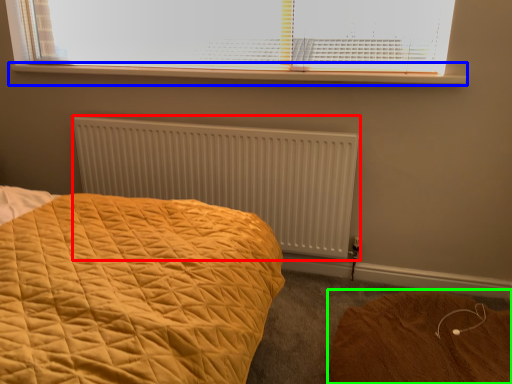
Question: Which object is the farthest from radiator (highlighted by a red box)? Choose among these: window sill (highlighted by a blue box) or plain (highlighted by a green box).

Choices:
 (A) window sill
 (B) plain

Answer: (B)